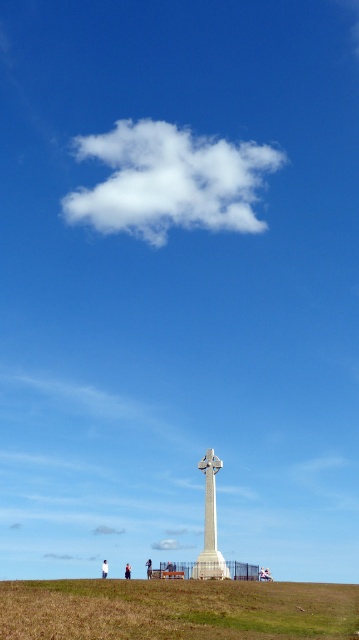
Question: Among these points, which one is farthest from the camera?

Choices:
 (A) (148, 563)
 (B) (217, 467)
 (C) (128, 568)

Answer: (C)

Question: Is the position of green grassy field at lower center more distant than that of white fluffy cloud at upper center?

Choices:
 (A) yes
 (B) no

Answer: (B)

Question: Among these objects, which one is nearest to the camera?

Choices:
 (A) white fluffy cloud at upper center
 (B) white stone cross at center
 (C) skinny jeans at lower center
 (D) white stone monument at center

Answer: (D)

Question: Observing the image, what is the correct spatial positioning of dark blue jeans at center in reference to skinny jeans at lower center?

Choices:
 (A) above
 (B) below

Answer: (A)

Question: Does white stone monument at center have a lesser width compared to reddish-brown fabric at center?

Choices:
 (A) no
 (B) yes

Answer: (A)

Question: Which point is closer to the camera?

Choices:
 (A) (73, 220)
 (B) (129, 636)

Answer: (B)